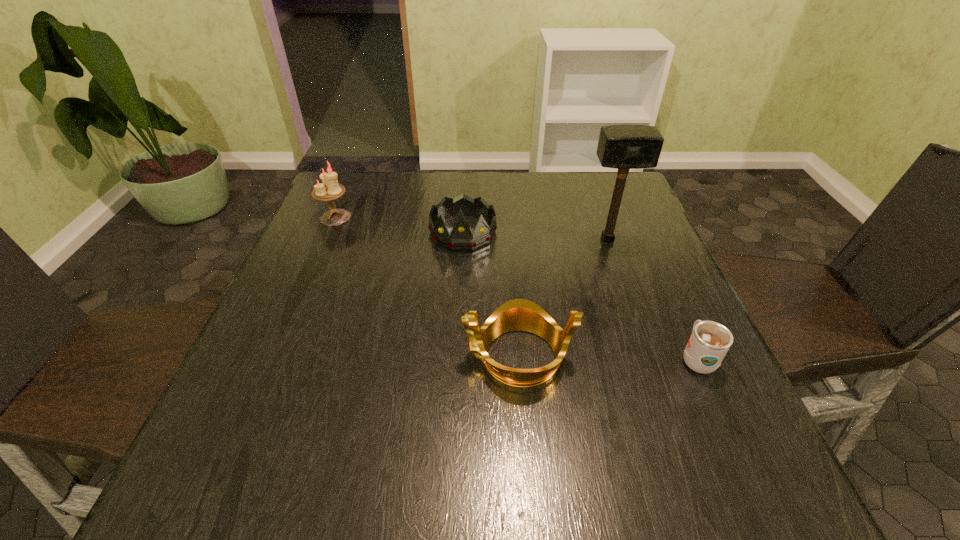
The width and height of the screenshot is (960, 540). What are the coordinates of `vacant area that lies between the farther tiara and the leftmost object` in the screenshot? It's located at (399, 225).

Locate an element on the screen. The width and height of the screenshot is (960, 540). free space that is in between the candle holder and the farther tiara is located at coordinates point(399,225).

I want to click on free space that is in between the fourth shortest object and the cup, so click(x=516, y=288).

At what (x,y) coordinates should I click in order to perform the action: click on unoccupied area between the tallest object and the cup. Please return your answer as a coordinate pair (x, y). Looking at the image, I should click on (652, 299).

This screenshot has height=540, width=960. What are the coordinates of `blank region between the second tallest object and the farther tiara` in the screenshot? It's located at (399, 225).

This screenshot has height=540, width=960. Find the location of `vacant space in between the candle holder and the mallet`. vacant space in between the candle holder and the mallet is located at coordinates (471, 228).

This screenshot has height=540, width=960. What are the coordinates of `vacant space that's between the leftmost object and the cup` in the screenshot? It's located at (516, 288).

Identify the location of the fourth closest object to the cup. This screenshot has height=540, width=960. (330, 189).

The width and height of the screenshot is (960, 540). I want to click on object identified as the fourth closest to the cup, so click(330, 189).

Locate an element on the screen. The height and width of the screenshot is (540, 960). free space that satisfies the following two spatial constraints: 1. on the side with the handle of the cup; 2. at the front emblem of the nearer tiara is located at coordinates (695, 356).